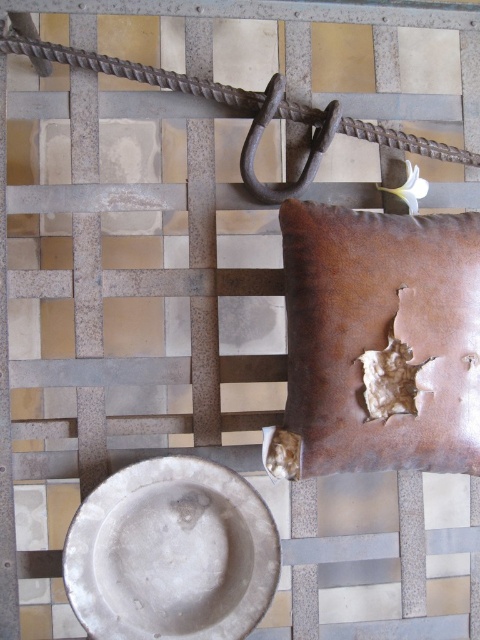
Is point (337, 435) positioned in front of point (400, 148)?

That is True.

Locate an element on the screen. This screenshot has width=480, height=640. leather pillow at center is located at coordinates (379, 342).

Identify the location of matte silver plate at center. The height and width of the screenshot is (640, 480). (171, 554).

Can you confirm if matte silver plate at center is shorter than rusty metal hook at center?

In fact, matte silver plate at center may be taller than rusty metal hook at center.

This screenshot has height=640, width=480. Find the location of `matte silver plate at center`. matte silver plate at center is located at coordinates (171, 554).

You are a GUI agent. You are given a task and a screenshot of the screen. Output one action in this format:
    pyautogui.click(x=<x>, y=<y>)
    Task: Click on the matte silver plate at center
    Image resolution: width=480 pixels, height=640 pixels.
    Given the screenshot: What is the action you would take?
    pyautogui.click(x=171, y=554)

Can you confirm if leather pillow at center is positioned to the right of rusty metal hook at center?

Yes, leather pillow at center is to the right of rusty metal hook at center.

Where is `leather pillow at center`? leather pillow at center is located at coordinates (379, 342).

The height and width of the screenshot is (640, 480). I want to click on leather pillow at center, so click(379, 342).

Locate an element on the screen. leather pillow at center is located at coordinates (379, 342).